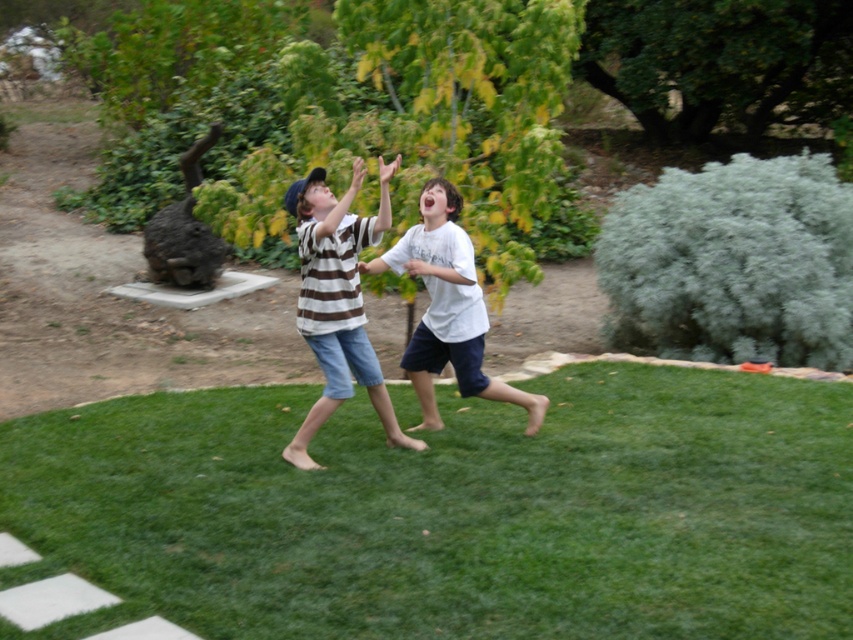
You are standing at the origin point in the image. The gray fluffy bush at right is located at coordinates point (733, 262). If you want to walk towards the gray fluffy bush at right, which direction should you move in terms of left or right?

The gray fluffy bush at right is located at point (733, 262), so you should move to the right to reach it.

You are a photographer trying to capture a photo of the two children playing. You notice the green grass at center and the green leafy tree at upper center in the background. Which object should you focus on if you want to highlight something closer to the children?

The green grass at center is closer to the children than the green leafy tree at upper center because it is smaller in the image.

You are a drone operator trying to capture a photo of the two children playing. To ensure the green grass at center is visible in the foreground, where should you position the drone?

The green grass at center is located at point (451,512), so position the drone above that coordinate to have it in the foreground.